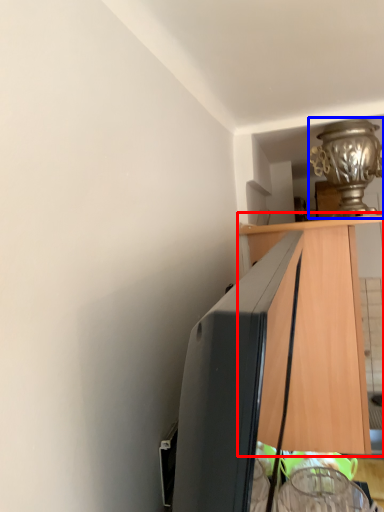
Question: Which point is further to the camera, cabinetry (highlighted by a red box) or lamp (highlighted by a blue box)?

Choices:
 (A) cabinetry
 (B) lamp

Answer: (B)